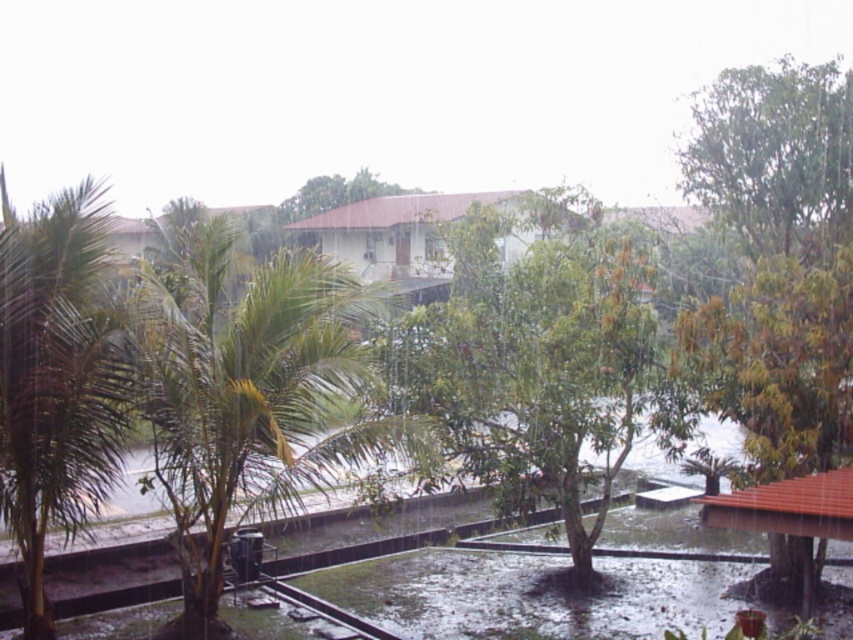
Can you confirm if green leafy palm tree at center is positioned to the right of green leafy tree at center?

No, green leafy palm tree at center is not to the right of green leafy tree at center.

Who is more forward, (215, 589) or (465, 348)?

Positioned in front is point (215, 589).

The image size is (853, 640). In order to click on green leafy palm tree at center in this screenshot , I will do `click(247, 392)`.

Between green leafy tree at center and green leafy palm tree at left, which one is positioned higher?

green leafy tree at center

Who is more forward, (630, 417) or (28, 506)?

Point (28, 506) is more forward.

Find the location of a particular element. green leafy tree at center is located at coordinates (534, 358).

Does green leafy palm tree at center appear over green leafy palm tree at left?

Correct, green leafy palm tree at center is located above green leafy palm tree at left.

Does green leafy palm tree at center appear on the right side of green leafy palm tree at left?

Incorrect, green leafy palm tree at center is not on the right side of green leafy palm tree at left.

Between point (200, 237) and point (65, 218), which one is positioned in front?

Point (65, 218)

At what (x,y) coordinates should I click in order to perform the action: click on green leafy palm tree at center. Please return your answer as a coordinate pair (x, y). The width and height of the screenshot is (853, 640). Looking at the image, I should click on (247, 392).